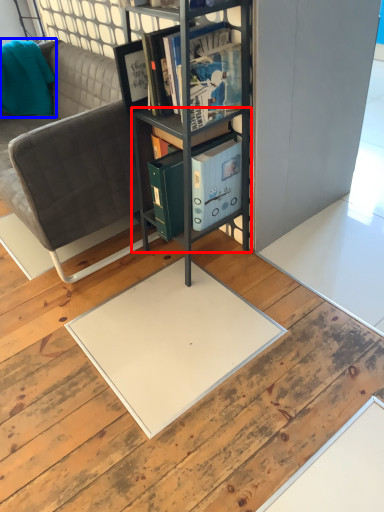
Question: Which of the following is the closest to the observer, cabinet (highlighted by a red box) or pillow (highlighted by a blue box)?

Choices:
 (A) cabinet
 (B) pillow

Answer: (A)